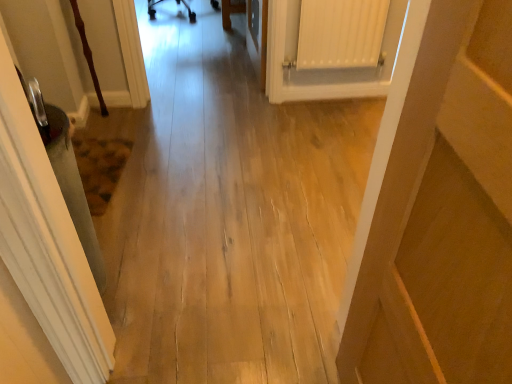
Question: From the image's perspective, is light wood floor at center under white matte radiator at upper right?

Choices:
 (A) yes
 (B) no

Answer: (A)

Question: Does light wood floor at center have a greater width compared to white matte radiator at upper right?

Choices:
 (A) yes
 (B) no

Answer: (A)

Question: Does light wood floor at center lie in front of white matte radiator at upper right?

Choices:
 (A) yes
 (B) no

Answer: (A)

Question: Does light wood floor at center come behind white matte radiator at upper right?

Choices:
 (A) no
 (B) yes

Answer: (A)

Question: Is light wood floor at center oriented towards white matte radiator at upper right?

Choices:
 (A) no
 (B) yes

Answer: (A)

Question: Considering the relative sizes of light wood floor at center and white matte radiator at upper right in the image provided, is light wood floor at center taller than white matte radiator at upper right?

Choices:
 (A) no
 (B) yes

Answer: (B)

Question: Is white matte radiator at upper right located outside wooden door at right?

Choices:
 (A) no
 (B) yes

Answer: (B)

Question: Does white matte radiator at upper right contain wooden door at right?

Choices:
 (A) no
 (B) yes

Answer: (A)

Question: From the image's perspective, does white matte radiator at upper right appear higher than wooden door at right?

Choices:
 (A) no
 (B) yes

Answer: (B)

Question: Is white matte radiator at upper right taller than wooden door at right?

Choices:
 (A) yes
 (B) no

Answer: (B)

Question: Considering the relative sizes of white matte radiator at upper right and wooden door at right in the image provided, is white matte radiator at upper right bigger than wooden door at right?

Choices:
 (A) yes
 (B) no

Answer: (B)

Question: Considering the relative sizes of white matte radiator at upper right and wooden door at right in the image provided, is white matte radiator at upper right thinner than wooden door at right?

Choices:
 (A) yes
 (B) no

Answer: (A)

Question: Is wooden door at right positioned with its back to light wood floor at center?

Choices:
 (A) yes
 (B) no

Answer: (B)